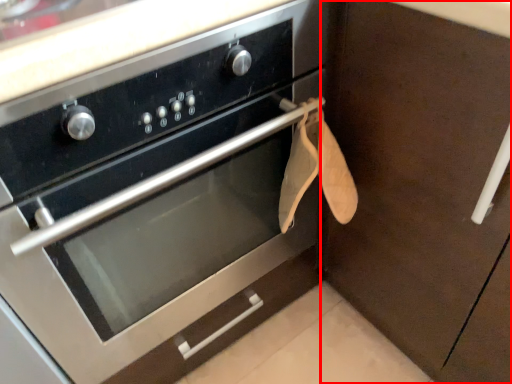
Question: Observing the image, what is the correct spatial positioning of cabinetry (annotated by the red box) in reference to oven?

Choices:
 (A) left
 (B) right

Answer: (B)